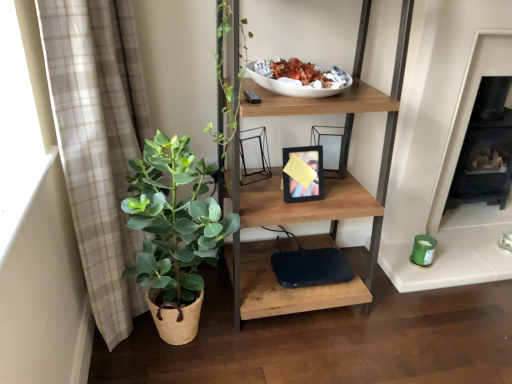
Locate an element on the screen. This screenshot has height=384, width=512. black matte fireplace at right is located at coordinates (485, 148).

What do you see at coordinates (99, 143) in the screenshot? I see `beige plaid curtain at left` at bounding box center [99, 143].

Identify the location of wooden shelf at center. (314, 201).

Find the location of a particular element. The image size is (512, 384). vegetation on the left of black matte fireplace at right is located at coordinates (174, 220).

Does green leafy plant in woven basket at left have a lesser height compared to black matte fireplace at right?

Incorrect, the height of green leafy plant in woven basket at left does not fall short of that of black matte fireplace at right.

Can you confirm if green leafy plant in woven basket at left is thinner than black matte fireplace at right?

Indeed, green leafy plant in woven basket at left has a lesser width compared to black matte fireplace at right.

Considering the sizes of objects green leafy plant in woven basket at left and black matte fireplace at right in the image provided, who is smaller, green leafy plant in woven basket at left or black matte fireplace at right?

green leafy plant in woven basket at left is smaller.

Is black matte fireplace at right to the left of green leafy plant in woven basket at left from the viewer's perspective?

No, black matte fireplace at right is not to the left of green leafy plant in woven basket at left.

Is black matte fireplace at right positioned beyond the bounds of green leafy plant in woven basket at left?

Yes, black matte fireplace at right is located beyond the bounds of green leafy plant in woven basket at left.

Which of these two, black matte fireplace at right or green leafy plant in woven basket at left, is smaller?

Smaller between the two is green leafy plant in woven basket at left.

From a real-world perspective, which object stands above the other?

black matte fireplace at right.

From the picture: From a real-world perspective, which is physically below, wooden shelf at center or black matte fireplace at right?

black matte fireplace at right is physically lower.

Is wooden shelf at center far from black matte fireplace at right?

That's not correct — wooden shelf at center is a little close to black matte fireplace at right.

Looking at this image, between wooden shelf at center and black matte fireplace at right, which one has less height?

Standing shorter between the two is black matte fireplace at right.

Does point (270, 181) come behind point (510, 85)?

No, (270, 181) is closer to viewer.

From their relative heights in the image, would you say wooden shelf at center is taller or shorter than beige plaid curtain at left?

In the image, wooden shelf at center appears to be taller than beige plaid curtain at left.

From a real-world perspective, between wooden shelf at center and beige plaid curtain at left, who is vertically higher?

wooden shelf at center, from a real-world perspective.

Who is bigger, wooden shelf at center or beige plaid curtain at left?

Bigger between the two is wooden shelf at center.

Is wooden shelf at center oriented away from beige plaid curtain at left?

That's not correct — wooden shelf at center is not looking away from beige plaid curtain at left.

Between black matte fireplace at right and beige plaid curtain at left, which one has larger size?

With larger size is beige plaid curtain at left.

Does black matte fireplace at right come behind beige plaid curtain at left?

Yes, black matte fireplace at right is behind beige plaid curtain at left.

Based on the photo, from a real-world perspective, between black matte fireplace at right and beige plaid curtain at left, who is vertically higher?

In real-world perspective, beige plaid curtain at left is above.

Is black matte fireplace at right completely or partially outside of beige plaid curtain at left?

Yes, black matte fireplace at right is not within beige plaid curtain at left.

Does wooden shelf at center contain green leafy plant in woven basket at left?

No, wooden shelf at center does not contain green leafy plant in woven basket at left.

Is wooden shelf at center placed right next to green leafy plant in woven basket at left?

No.

Which is less distant, (242, 271) or (122, 208)?

The point (122, 208) is closer.

From the image's perspective, is wooden shelf at center on top of green leafy plant in woven basket at left?

Correct, wooden shelf at center appears higher than green leafy plant in woven basket at left in the image.

Is beige plaid curtain at left thinner than green leafy plant in woven basket at left?

Correct, the width of beige plaid curtain at left is less than that of green leafy plant in woven basket at left.

Between beige plaid curtain at left and green leafy plant in woven basket at left, which one has smaller size?

green leafy plant in woven basket at left is smaller.

Is beige plaid curtain at left positioned far away from green leafy plant in woven basket at left?

No, beige plaid curtain at left is in close proximity to green leafy plant in woven basket at left.

Could you tell me if beige plaid curtain at left is facing green leafy plant in woven basket at left?

Yes, beige plaid curtain at left is turned towards green leafy plant in woven basket at left.

I want to click on vegetation below the black matte fireplace at right (from the image's perspective), so click(x=174, y=220).

Find the location of a particular element. This screenshot has height=384, width=512. fireplace located above the green leafy plant in woven basket at left (from a real-world perspective) is located at coordinates (485, 148).

Which object lies further to the anchor point green leafy plant in woven basket at left, beige plaid curtain at left or wooden shelf at center?

The object further to green leafy plant in woven basket at left is wooden shelf at center.

Which object lies further to the anchor point wooden shelf at center, beige plaid curtain at left or green leafy plant in woven basket at left?

beige plaid curtain at left is positioned further to the anchor wooden shelf at center.

Estimate the real-world distances between objects in this image. Which object is further from green leafy plant in woven basket at left, wooden shelf at center or beige plaid curtain at left?

wooden shelf at center is further to green leafy plant in woven basket at left.

Which object lies nearer to the anchor point beige plaid curtain at left, wooden shelf at center or green leafy plant in woven basket at left?

Based on the image, green leafy plant in woven basket at left appears to be nearer to beige plaid curtain at left.

Consider the image. Based on their spatial positions, is green leafy plant in woven basket at left or beige plaid curtain at left further from wooden shelf at center?

Based on the image, beige plaid curtain at left appears to be further to wooden shelf at center.

Looking at the image, which one is located further to wooden shelf at center, black matte fireplace at right or green leafy plant in woven basket at left?

Based on the image, black matte fireplace at right appears to be further to wooden shelf at center.

In the scene shown: Based on their spatial positions, is wooden shelf at center or black matte fireplace at right closer to beige plaid curtain at left?

The object closer to beige plaid curtain at left is wooden shelf at center.

Estimate the real-world distances between objects in this image. Which object is closer to beige plaid curtain at left, black matte fireplace at right or green leafy plant in woven basket at left?

Based on the image, green leafy plant in woven basket at left appears to be nearer to beige plaid curtain at left.

Locate an element on the screen. The image size is (512, 384). vegetation between beige plaid curtain at left and black matte fireplace at right in the horizontal direction is located at coordinates (174, 220).

I want to click on shelf between beige plaid curtain at left and black matte fireplace at right from left to right, so click(314, 201).

Find the location of `vegetation located between beige plaid curtain at left and wooden shelf at center in the left-right direction`. vegetation located between beige plaid curtain at left and wooden shelf at center in the left-right direction is located at coordinates (174, 220).

Where is `shelf between green leafy plant in woven basket at left and black matte fireplace at right`? The width and height of the screenshot is (512, 384). shelf between green leafy plant in woven basket at left and black matte fireplace at right is located at coordinates (314, 201).